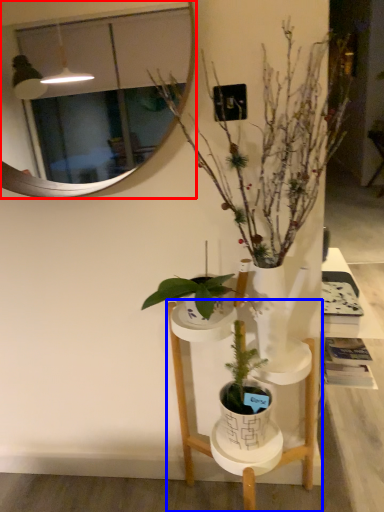
Question: Among these objects, which one is nearest to the camera, mirror (highlighted by a red box) or furniture (highlighted by a blue box)?

Choices:
 (A) mirror
 (B) furniture

Answer: (B)